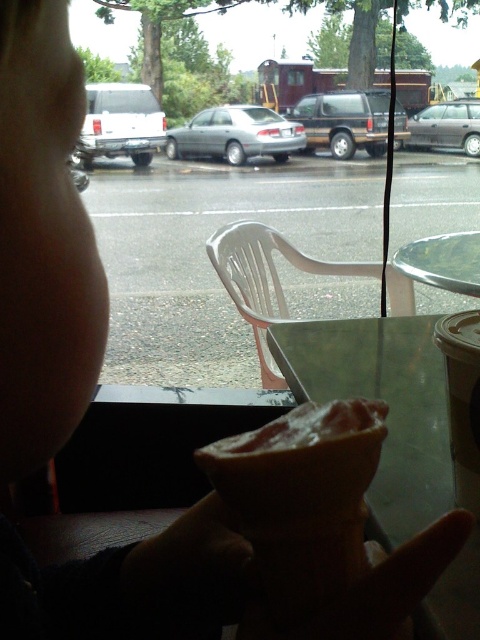
Is white plastic chair at center behind satin silver sedan at center?

No, white plastic chair at center is in front of satin silver sedan at center.

Between point (411, 289) and point (254, 144), which one is positioned behind?

The point (254, 144) is more distant.

The width and height of the screenshot is (480, 640). I want to click on white plastic chair at center, so click(266, 280).

Measure the distance between transparent glass table at center and white matte van at left.

The distance of transparent glass table at center from white matte van at left is 7.94 meters.

Is transparent glass table at center below white matte van at left?

Indeed, transparent glass table at center is positioned under white matte van at left.

This screenshot has height=640, width=480. What do you see at coordinates (388, 406) in the screenshot? I see `transparent glass table at center` at bounding box center [388, 406].

This screenshot has width=480, height=640. Find the location of `transparent glass table at center`. transparent glass table at center is located at coordinates (388, 406).

Does transparent glass table at center appear on the left side of spongy pink cake at lower center?

No, transparent glass table at center is not to the left of spongy pink cake at lower center.

Can you confirm if transparent glass table at center is positioned below spongy pink cake at lower center?

No.

The height and width of the screenshot is (640, 480). What do you see at coordinates (388, 406) in the screenshot? I see `transparent glass table at center` at bounding box center [388, 406].

Identify the location of transparent glass table at center. This screenshot has width=480, height=640. (388, 406).